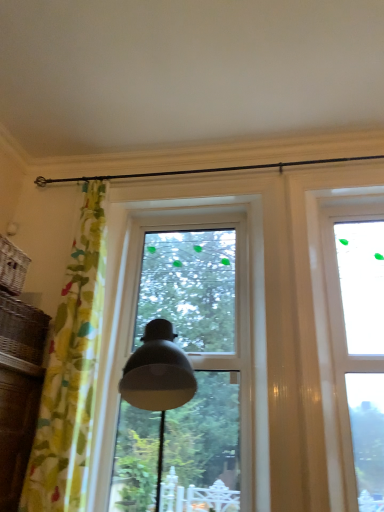
Describe the element at coordinates (198, 352) in the screenshot. I see `transparent glass window at center, marked as the first window in a left-to-right arrangement` at that location.

How much space does woven wicker basket at left, which appears as the first basket when viewed from the top, occupy horizontally?

9.42 inches.

Describe the element at coordinates (12, 267) in the screenshot. I see `woven wicker basket at left, positioned as the second basket in bottom-to-top order` at that location.

Measure the distance between point (69, 395) and camera.

Point (69, 395) is 2.20 meters away from camera.

The height and width of the screenshot is (512, 384). Identify the location of transparent glass window at upper right, the second window in the left-to-right sequence. (358, 350).

Where is `woven brown basket at left, which ranks as the 2th basket in top-to-bottom order`? woven brown basket at left, which ranks as the 2th basket in top-to-bottom order is located at coordinates (22, 329).

Which is in front, woven wicker basket at left, positioned as the second basket in bottom-to-top order, or transparent glass window at center, arranged as the 2th window when viewed from the right?

woven wicker basket at left, positioned as the second basket in bottom-to-top order, is more forward.

Is woven wicker basket at left, which appears as the first basket when viewed from the top, far away from transparent glass window at center, marked as the first window in a left-to-right arrangement?

That's right, there is a large distance between woven wicker basket at left, which appears as the first basket when viewed from the top, and transparent glass window at center, marked as the first window in a left-to-right arrangement.

Which object is wider, woven wicker basket at left, which appears as the first basket when viewed from the top, or transparent glass window at center, arranged as the 2th window when viewed from the right?

Wider between the two is woven wicker basket at left, which appears as the first basket when viewed from the top.

How many degrees apart are the facing directions of woven wicker basket at left, positioned as the second basket in bottom-to-top order, and transparent glass window at center, arranged as the 2th window when viewed from the right?

The angular difference between woven wicker basket at left, positioned as the second basket in bottom-to-top order, and transparent glass window at center, arranged as the 2th window when viewed from the right, is 90.5 degrees.

How much distance is there between transparent glass window at center, arranged as the 2th window when viewed from the right, and woven wicker basket at left, positioned as the second basket in bottom-to-top order?

transparent glass window at center, arranged as the 2th window when viewed from the right, and woven wicker basket at left, positioned as the second basket in bottom-to-top order, are 1.13 meters apart.

Can you confirm if transparent glass window at center, marked as the first window in a left-to-right arrangement, is thinner than woven wicker basket at left, which appears as the first basket when viewed from the top?

Indeed, transparent glass window at center, marked as the first window in a left-to-right arrangement, has a lesser width compared to woven wicker basket at left, which appears as the first basket when viewed from the top.

Which is closer to the camera, [193,469] or [20,275]?

The point [20,275] is closer.

Could woven wicker basket at left, which appears as the first basket when viewed from the top, be considered to be inside woven brown basket at left, the 1th basket from the bottom?

No, woven wicker basket at left, which appears as the first basket when viewed from the top, is located outside of woven brown basket at left, the 1th basket from the bottom.

Is woven brown basket at left, which ranks as the 2th basket in top-to-bottom order, positioned with its back to woven wicker basket at left, which appears as the first basket when viewed from the top?

No, woven brown basket at left, which ranks as the 2th basket in top-to-bottom order,'s orientation is not away from woven wicker basket at left, which appears as the first basket when viewed from the top.

From the image's perspective, between woven brown basket at left, which ranks as the 2th basket in top-to-bottom order, and woven wicker basket at left, positioned as the second basket in bottom-to-top order, who is located below?

woven brown basket at left, which ranks as the 2th basket in top-to-bottom order, is shown below in the image.

Considering the sizes of objects woven brown basket at left, which ranks as the 2th basket in top-to-bottom order, and woven wicker basket at left, positioned as the second basket in bottom-to-top order, in the image provided, who is taller, woven brown basket at left, which ranks as the 2th basket in top-to-bottom order, or woven wicker basket at left, positioned as the second basket in bottom-to-top order,?

Standing taller between the two is woven brown basket at left, which ranks as the 2th basket in top-to-bottom order.

From the image's perspective, is transparent glass window at center, marked as the first window in a left-to-right arrangement, above woven brown basket at left, the 1th basket from the bottom?

No.

Is transparent glass window at center, marked as the first window in a left-to-right arrangement, turned away from woven brown basket at left, the 1th basket from the bottom?

transparent glass window at center, marked as the first window in a left-to-right arrangement, does not have its back to woven brown basket at left, the 1th basket from the bottom.

Between transparent glass window at center, arranged as the 2th window when viewed from the right, and woven brown basket at left, the 1th basket from the bottom, which one appears on the right side from the viewer's perspective?

transparent glass window at center, arranged as the 2th window when viewed from the right.

Is transparent glass window at center, arranged as the 2th window when viewed from the right, next to woven brown basket at left, the 1th basket from the bottom, and touching it?

No, transparent glass window at center, arranged as the 2th window when viewed from the right, is not beside woven brown basket at left, the 1th basket from the bottom.

Does yellow floral fabric curtain at left turn towards woven wicker basket at left, positioned as the second basket in bottom-to-top order?

No, yellow floral fabric curtain at left is not turned towards woven wicker basket at left, positioned as the second basket in bottom-to-top order.

From a real-world perspective, is yellow floral fabric curtain at left above or below woven wicker basket at left, which appears as the first basket when viewed from the top?

From a real-world perspective, yellow floral fabric curtain at left is physically below woven wicker basket at left, which appears as the first basket when viewed from the top.

Does point (90, 362) come farther from viewer compared to point (26, 259)?

Yes, it is.

In the scene shown: From the image's perspective, is transparent glass window at upper right, which is counted as the 1th window, starting from the right, located beneath transparent glass window at center, arranged as the 2th window when viewed from the right?

No.

Consider the image. Is transparent glass window at upper right, which is counted as the 1th window, starting from the right, situated inside transparent glass window at center, marked as the first window in a left-to-right arrangement, or outside?

transparent glass window at upper right, which is counted as the 1th window, starting from the right, is outside transparent glass window at center, marked as the first window in a left-to-right arrangement.

Which is more to the right, transparent glass window at upper right, the second window in the left-to-right sequence, or transparent glass window at center, arranged as the 2th window when viewed from the right?

Positioned to the right is transparent glass window at upper right, the second window in the left-to-right sequence.

From a real-world perspective, is transparent glass window at upper right, the second window in the left-to-right sequence, physically located above or below transparent glass window at center, arranged as the 2th window when viewed from the right?

In terms of real-world spatial position, transparent glass window at upper right, the second window in the left-to-right sequence, is above transparent glass window at center, arranged as the 2th window when viewed from the right.

Is point (211, 225) closer to camera compared to point (84, 292)?

No, (211, 225) is further to viewer.

Considering the relative sizes of transparent glass window at center, arranged as the 2th window when viewed from the right, and yellow floral fabric curtain at left in the image provided, is transparent glass window at center, arranged as the 2th window when viewed from the right, thinner than yellow floral fabric curtain at left?

Yes.

Between transparent glass window at center, marked as the first window in a left-to-right arrangement, and yellow floral fabric curtain at left, which one is positioned in front?

yellow floral fabric curtain at left is in front.

Starting from the woven wicker basket at left, which appears as the first basket when viewed from the top, which window is the 2nd one behind? Please provide its 2D coordinates.

[(198, 352)]

In order to click on the 2nd basket above the transparent glass window at center, arranged as the 2th window when viewed from the right (from the image's perspective) in this screenshot , I will do `click(12, 267)`.

Looking at the image, which one is located closer to woven brown basket at left, the 1th basket from the bottom, transparent glass window at upper right, which is counted as the 1th window, starting from the right, or yellow floral fabric curtain at left?

Among the two, yellow floral fabric curtain at left is located nearer to woven brown basket at left, the 1th basket from the bottom.

In the scene shown: Based on their spatial positions, is transparent glass window at upper right, which is counted as the 1th window, starting from the right, or woven brown basket at left, the 1th basket from the bottom, closer to woven wicker basket at left, positioned as the second basket in bottom-to-top order?

woven brown basket at left, the 1th basket from the bottom, is closer to woven wicker basket at left, positioned as the second basket in bottom-to-top order.

Based on the photo, based on their spatial positions, is woven brown basket at left, the 1th basket from the bottom, or transparent glass window at upper right, the second window in the left-to-right sequence, further from transparent glass window at center, marked as the first window in a left-to-right arrangement?

woven brown basket at left, the 1th basket from the bottom, is further to transparent glass window at center, marked as the first window in a left-to-right arrangement.

Based on their spatial positions, is woven brown basket at left, which ranks as the 2th basket in top-to-bottom order, or woven wicker basket at left, which appears as the first basket when viewed from the top, closer to transparent glass window at upper right, the second window in the left-to-right sequence?

woven brown basket at left, which ranks as the 2th basket in top-to-bottom order, is positioned closer to the anchor transparent glass window at upper right, the second window in the left-to-right sequence.

When comparing their distances from yellow floral fabric curtain at left, does transparent glass window at center, marked as the first window in a left-to-right arrangement, or woven wicker basket at left, which appears as the first basket when viewed from the top, seem further?

The object further to yellow floral fabric curtain at left is woven wicker basket at left, which appears as the first basket when viewed from the top.

Consider the image. Estimate the real-world distances between objects in this image. Which object is closer to woven wicker basket at left, which appears as the first basket when viewed from the top, yellow floral fabric curtain at left or woven brown basket at left, the 1th basket from the bottom?

The object closer to woven wicker basket at left, which appears as the first basket when viewed from the top, is woven brown basket at left, the 1th basket from the bottom.

From the picture: Looking at the image, which one is located closer to yellow floral fabric curtain at left, transparent glass window at upper right, the second window in the left-to-right sequence, or transparent glass window at center, arranged as the 2th window when viewed from the right?

Based on the image, transparent glass window at center, arranged as the 2th window when viewed from the right, appears to be nearer to yellow floral fabric curtain at left.

Based on their spatial positions, is woven wicker basket at left, which appears as the first basket when viewed from the top, or yellow floral fabric curtain at left further from transparent glass window at center, arranged as the 2th window when viewed from the right?

Based on the image, woven wicker basket at left, which appears as the first basket when viewed from the top, appears to be further to transparent glass window at center, arranged as the 2th window when viewed from the right.

Locate an element on the screen. curtain located between woven brown basket at left, the 1th basket from the bottom, and transparent glass window at upper right, which is counted as the 1th window, starting from the right, in the left-right direction is located at coordinates (71, 372).

Find the location of a particular element. The height and width of the screenshot is (512, 384). basket between woven brown basket at left, which ranks as the 2th basket in top-to-bottom order, and transparent glass window at upper right, the second window in the left-to-right sequence is located at coordinates (12, 267).

This screenshot has width=384, height=512. Identify the location of basket between woven brown basket at left, the 1th basket from the bottom, and yellow floral fabric curtain at left, in the horizontal direction. (12, 267).

You are a GUI agent. You are given a task and a screenshot of the screen. Output one action in this format:
    pyautogui.click(x=<x>, y=<y>)
    Task: Click on the window between woven wicker basket at left, positioned as the second basket in bottom-to-top order, and transparent glass window at upper right, which is counted as the 1th window, starting from the right
    
    Given the screenshot: What is the action you would take?
    pyautogui.click(x=198, y=352)